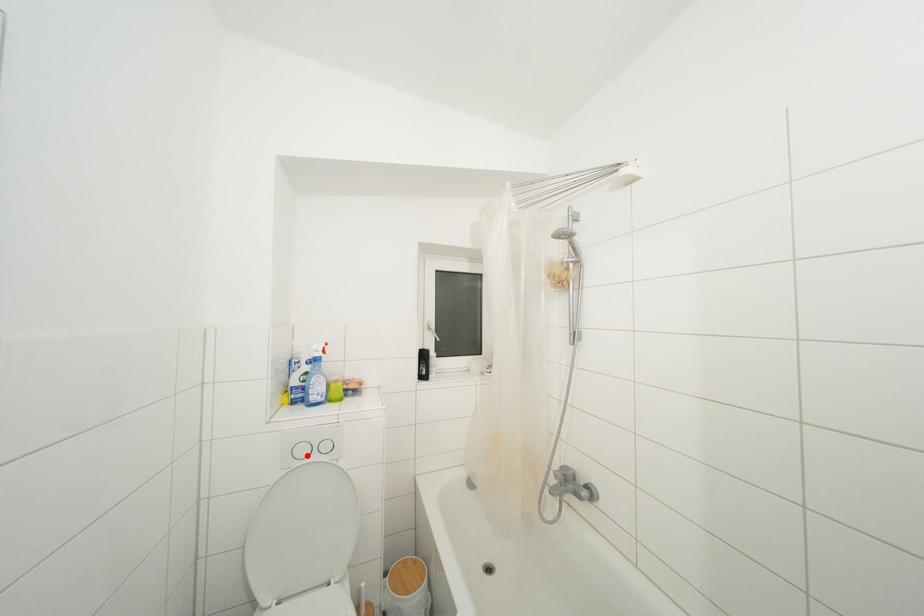
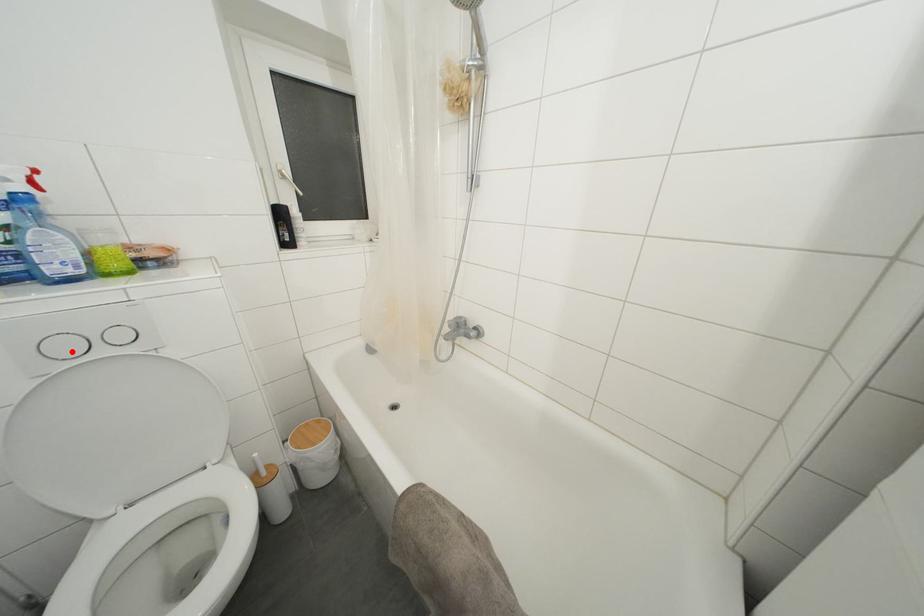
I am providing you with two images of the same scene from different viewpoints. A red point is marked on the first image and another point is marked on the second image. Is the marked point in image1 the same physical position as the marked point in image2?

Yes